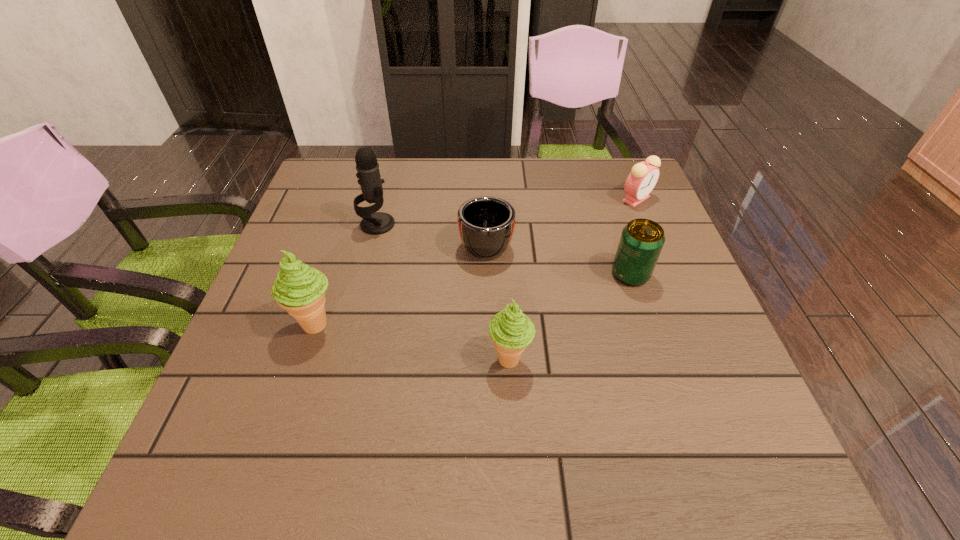
Where is `vacant area that lies between the microphone and the mug`? This screenshot has height=540, width=960. vacant area that lies between the microphone and the mug is located at coordinates (432, 233).

I want to click on free space between the beer can and the third tallest object, so click(x=570, y=316).

What are the coordinates of `free space between the mug and the left icecream` in the screenshot? It's located at (401, 282).

At what (x,y) coordinates should I click in order to perform the action: click on empty space between the taller icecream and the mug. Please return your answer as a coordinate pair (x, y). Looking at the image, I should click on (401, 282).

Locate an element on the screen. The image size is (960, 540). unoccupied position between the taller icecream and the fourth shortest object is located at coordinates (413, 342).

The image size is (960, 540). Find the location of `free space between the microphone and the mug`. free space between the microphone and the mug is located at coordinates (432, 233).

Where is `unoccupied area between the left icecream and the mug`? unoccupied area between the left icecream and the mug is located at coordinates (401, 282).

Choose which object is the nearest neighbor to the beer can. Please provide its 2D coordinates. Your answer should be formatted as a tuple, i.e. [(x, y)], where the tuple contains the x and y coordinates of a point satisfying the conditions above.

[(643, 177)]

Identify which object is located as the fifth nearest to the microphone. Please provide its 2D coordinates. Your answer should be formatted as a tuple, i.e. [(x, y)], where the tuple contains the x and y coordinates of a point satisfying the conditions above.

[(643, 177)]

The height and width of the screenshot is (540, 960). In order to click on free location that satisfies the following two spatial constraints: 1. on the back side of the shorter icecream; 2. on the right side of the beer can in this screenshot , I will do [505, 274].